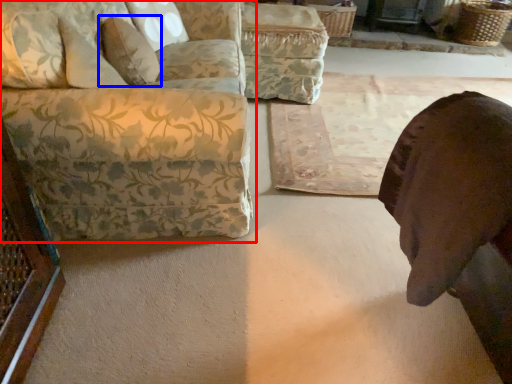
Question: Which object is further to the camera taking this photo, studio couch (highlighted by a red box) or pillow (highlighted by a blue box)?

Choices:
 (A) studio couch
 (B) pillow

Answer: (B)